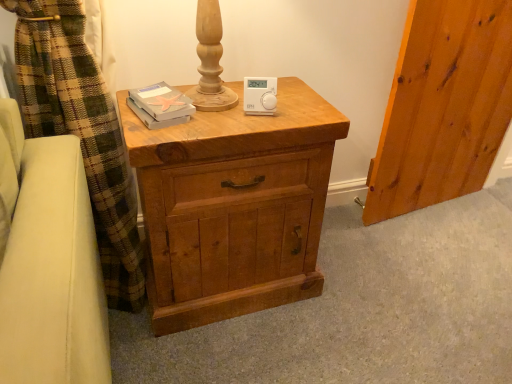
This screenshot has height=384, width=512. Identify the location of free space between matte gray book at upper left and white plastic thermostat at center. (209, 105).